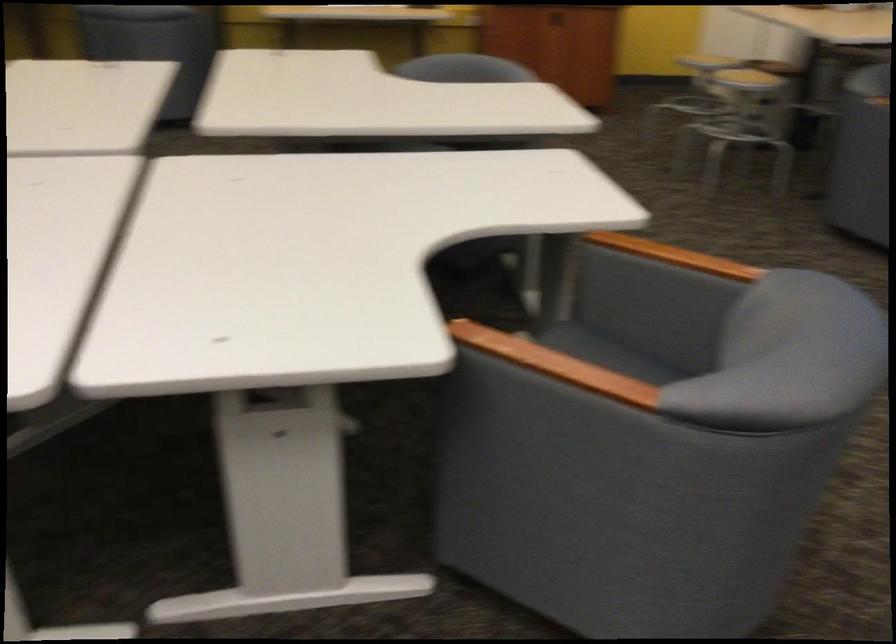
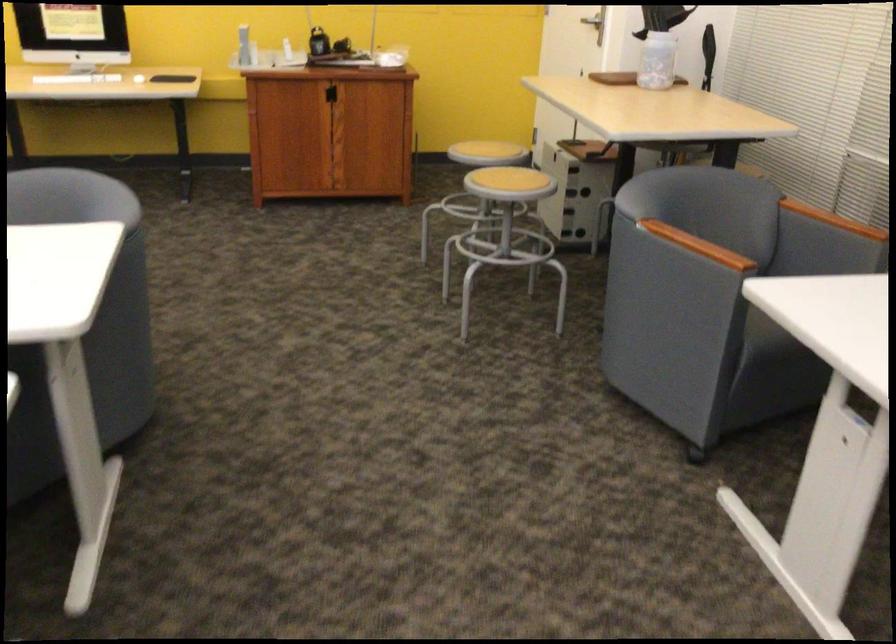
The images are taken continuously from a first-person perspective. In which direction are you moving?

The cameraman moved toward right, forward.